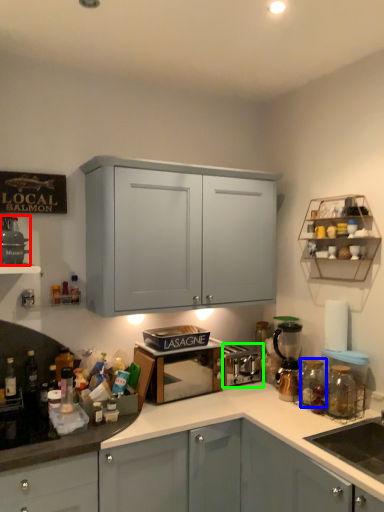
Question: Which object is positioned closest to appliance (highlighted by a red box)? Select from glass jar (highlighted by a blue box) and appliance (highlighted by a green box).

Choices:
 (A) glass jar
 (B) appliance

Answer: (B)